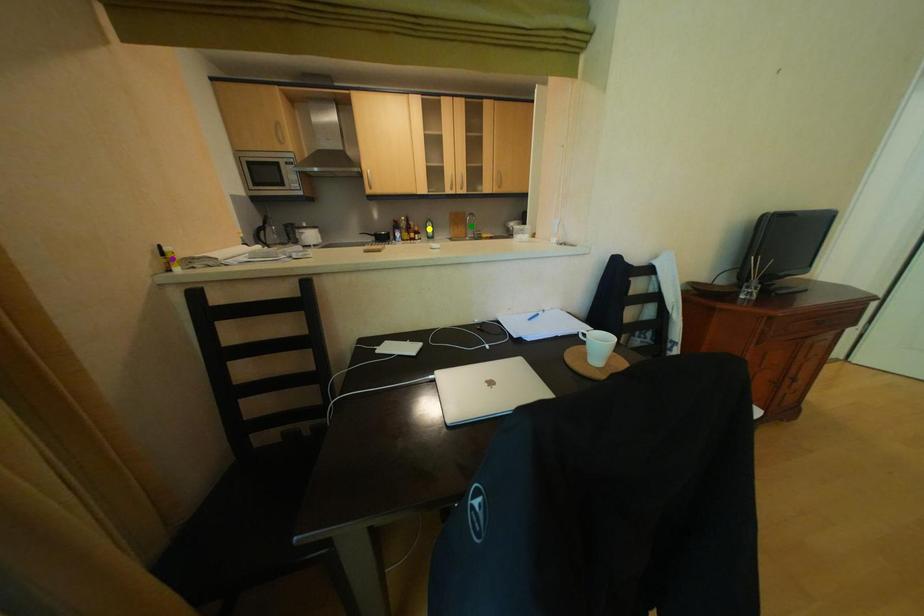
Order these from nearest to farthest:
purple point | yellow point | green point

purple point
yellow point
green point